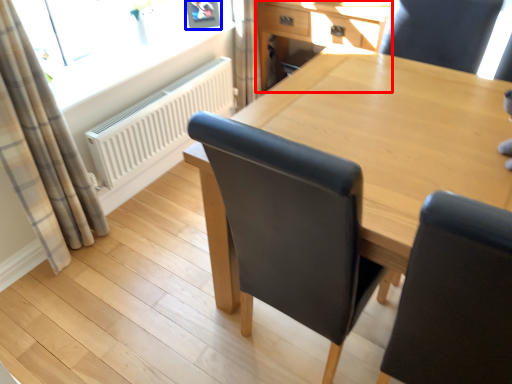
Question: Which object appears closest to the camera in this image, computer desk (highlighted by a red box) or picture frame (highlighted by a blue box)?

Choices:
 (A) computer desk
 (B) picture frame

Answer: (A)